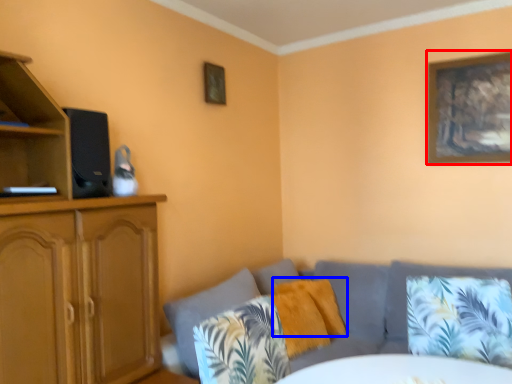
Question: Which of the following is the farthest to the observer, picture frame (highlighted by a red box) or pillow (highlighted by a blue box)?

Choices:
 (A) picture frame
 (B) pillow

Answer: (A)